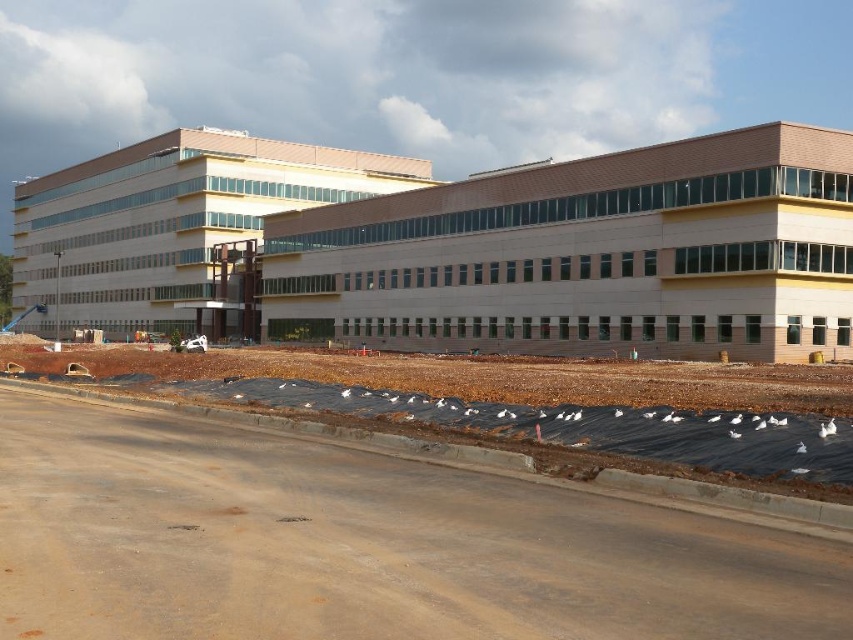
Between brown dirt at lower center and beige concrete building at center, which one has more height?

With more height is beige concrete building at center.

Is brown dirt at lower center bigger than beige concrete building at center?

No, brown dirt at lower center is not bigger than beige concrete building at center.

I want to click on brown dirt at lower center, so click(x=361, y=545).

This screenshot has width=853, height=640. In order to click on brown dirt at lower center in this screenshot , I will do `click(361, 545)`.

Is point (828, 157) less distant than point (126, 157)?

Yes, it is in front of point (126, 157).

The width and height of the screenshot is (853, 640). I want to click on beige concrete building at center, so click(589, 256).

Can you confirm if brown dirt at lower center is bigger than matte beige building at center?

Actually, brown dirt at lower center might be smaller than matte beige building at center.

Who is more distant from viewer, (160, 468) or (103, 227)?

Point (103, 227)

Where is `brown dirt at lower center`? The image size is (853, 640). brown dirt at lower center is located at coordinates (361, 545).

This screenshot has width=853, height=640. I want to click on brown dirt at lower center, so click(x=361, y=545).